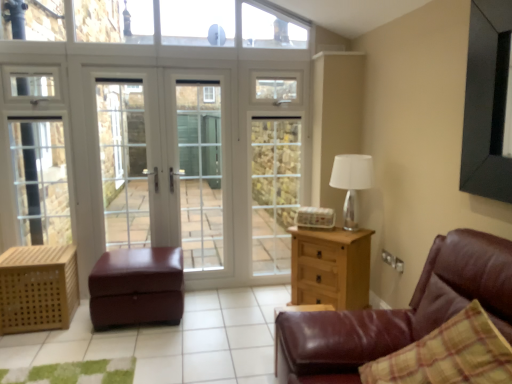
Question: Does white glass screen door at center, which ranks as the third screen door in left-to-right order, have a lesser height compared to brown leather couch at right?

Choices:
 (A) yes
 (B) no

Answer: (B)

Question: Does white glass screen door at center, which ranks as the first screen door in right-to-left order, lie in front of brown leather couch at right?

Choices:
 (A) yes
 (B) no

Answer: (B)

Question: From the image's perspective, is white glass screen door at center, which ranks as the third screen door in left-to-right order, located above brown leather couch at right?

Choices:
 (A) yes
 (B) no

Answer: (A)

Question: Is white glass screen door at center, which ranks as the first screen door in right-to-left order, surrounding brown leather couch at right?

Choices:
 (A) yes
 (B) no

Answer: (B)

Question: Can you confirm if white glass screen door at center, which ranks as the third screen door in left-to-right order, is wider than brown leather couch at right?

Choices:
 (A) no
 (B) yes

Answer: (A)

Question: Is white glass screen door at center, which ranks as the first screen door in right-to-left order, not within brown leather couch at right?

Choices:
 (A) no
 (B) yes

Answer: (B)

Question: Is white glass screen door at center, acting as the second screen door starting from the left, located within white glass screen door at center, which ranks as the third screen door in left-to-right order?

Choices:
 (A) yes
 (B) no

Answer: (B)

Question: Is the depth of white glass screen door at center, which ranks as the third screen door in left-to-right order, less than that of white glass screen door at center, acting as the second screen door starting from the left?

Choices:
 (A) yes
 (B) no

Answer: (B)

Question: Does white glass screen door at center, which ranks as the first screen door in right-to-left order, come behind white glass screen door at center, acting as the second screen door starting from the left?

Choices:
 (A) no
 (B) yes

Answer: (B)

Question: Would you consider white glass screen door at center, which ranks as the first screen door in right-to-left order, to be distant from white glass screen door at center, the 2th screen door viewed from the right?

Choices:
 (A) no
 (B) yes

Answer: (A)

Question: Are white glass screen door at center, which ranks as the third screen door in left-to-right order, and white glass screen door at center, the 2th screen door viewed from the right, beside each other?

Choices:
 (A) yes
 (B) no

Answer: (B)

Question: Does white glass screen door at center, which ranks as the third screen door in left-to-right order, have a larger size compared to white glass screen door at center, acting as the second screen door starting from the left?

Choices:
 (A) no
 (B) yes

Answer: (B)

Question: Is there a large distance between clear glass window at upper center and light wood/texture chest of drawers at right?

Choices:
 (A) no
 (B) yes

Answer: (B)